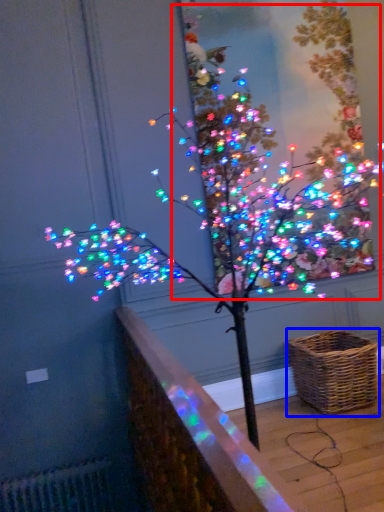
Question: Which of the following is the farthest to the observer, christmas tree (highlighted by a red box) or picnic basket (highlighted by a blue box)?

Choices:
 (A) christmas tree
 (B) picnic basket

Answer: (A)